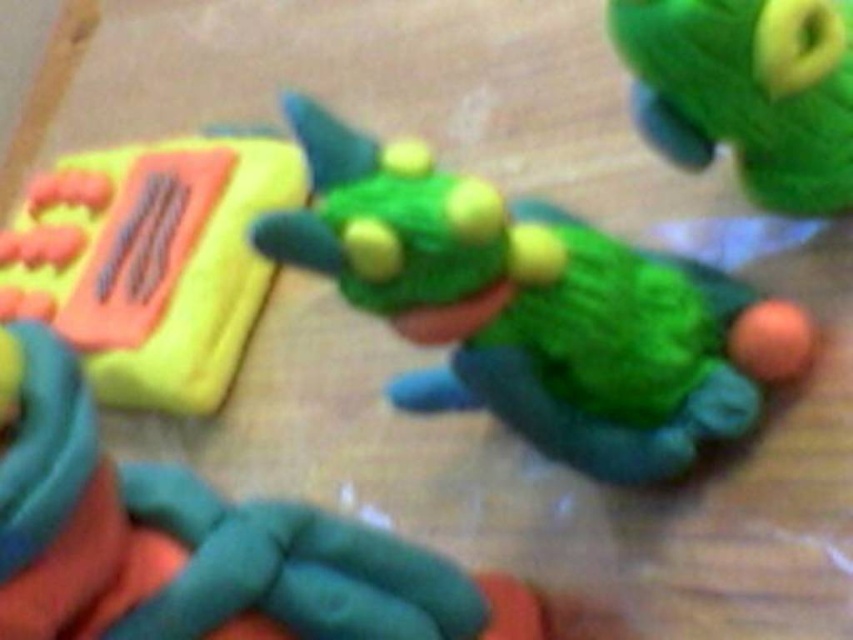
From the picture: Who is positioned more to the left, green clay dragon at center or matte green clay turtle at center?

matte green clay turtle at center is more to the left.

Which of these two, green clay dragon at center or matte green clay turtle at center, stands shorter?

matte green clay turtle at center is shorter.

Find the location of a particular element. green clay dragon at center is located at coordinates (534, 307).

Is green clay dragon at center thinner than yellow matte phone at left?

No, green clay dragon at center is not thinner than yellow matte phone at left.

Identify the location of green clay dragon at center. This screenshot has height=640, width=853. (534, 307).

Does point (624, 380) come behind point (250, 291)?

No, (624, 380) is closer to viewer.

Locate an element on the screen. green clay dragon at center is located at coordinates (534, 307).

Looking at this image, who is more distant from viewer, (415, 141) or (837, 48)?

The point (415, 141) is behind.

The image size is (853, 640). What do you see at coordinates (534, 307) in the screenshot?
I see `green clay dragon at center` at bounding box center [534, 307].

The image size is (853, 640). Identify the location of green clay dragon at center. (534, 307).